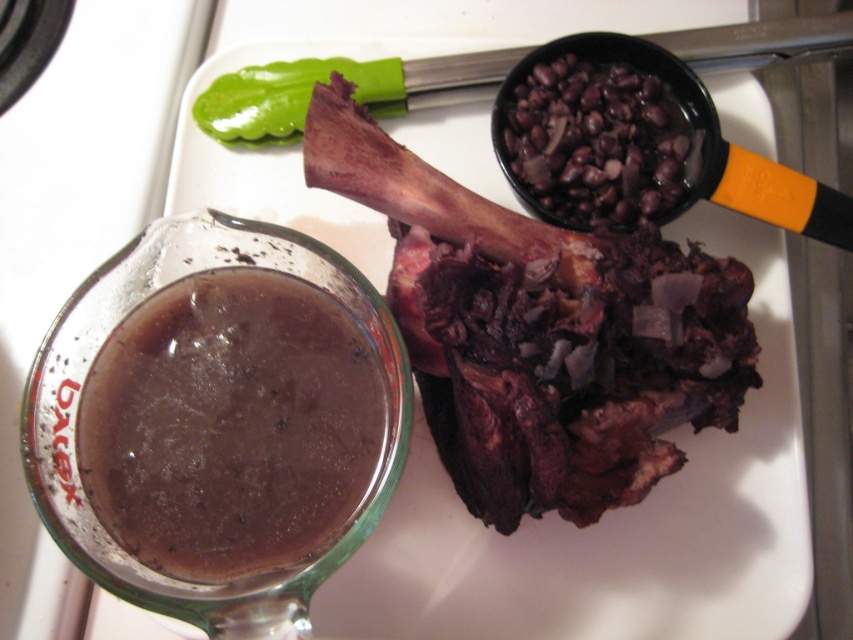
Based on the photo, you are a chef preparing a dish and need to place the dark brown meat at center and the black matte beans at upper right onto a serving tray. The tray has a height limit of 10 cm. Can both items fit on the tray without exceeding the height limit?

The dark brown meat at center is much taller than the black matte beans at upper right. Since the meat is taller and the tray has a 10 cm height limit, it depends on the exact height of the meat. However, the description only states it is taller than the beans but does not provide specific measurements. Without knowing the exact height of the meat, we cannot confirm if it exceeds 10 cm. Please measure the meat to ensure compliance.

You are a food stylist arranging items on a white countertop. You have two points marked on the setup. The first point is at coordinate point(219, 429) and the second is at point(543, 150). If you want to place a new decorative item between them, which point should you move closer to ensure it sits in front?

To place the decorative item between the two points and have it sit in front, you should move it closer to point(219, 429) since it is in front of point(543, 150).

You are a chef arranging ingredients on a white kitchen countertop. You have a translucent glass gravy at lower left and black matte beans at upper right. Where should you place a new ingredient that needs to be closer to the gravy than the beans?

Place the new ingredient between the translucent glass gravy at lower left and the black matte beans at upper right, closer to the gravy since it is positioned under the beans.